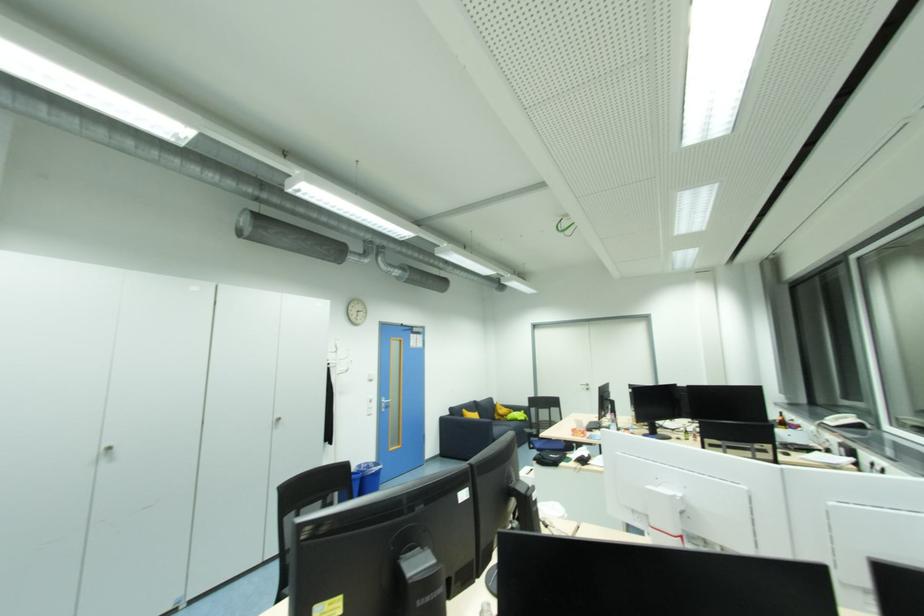
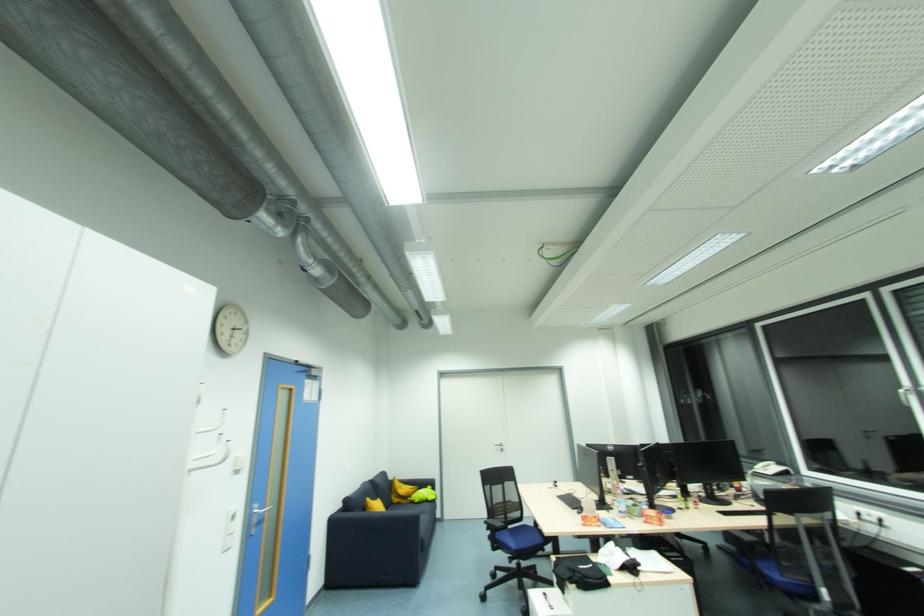
Locate, in the second image, the point that corresponds to point 373,402 in the first image.

(236, 520)